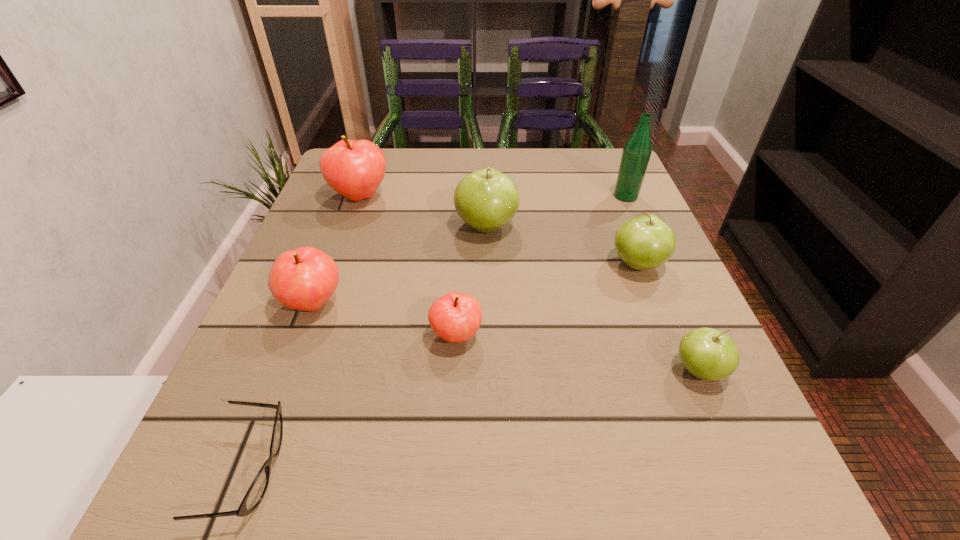
The width and height of the screenshot is (960, 540). In the image, there is a desktop. What are the coordinates of `vacant region at the far left corner` in the screenshot? It's located at (398, 159).

Identify the location of vacant region at the far right corner of the desktop. (566, 158).

Where is `empty space that is in between the bottle and the smallest green apple`? empty space that is in between the bottle and the smallest green apple is located at coordinates (662, 284).

This screenshot has height=540, width=960. Find the location of `free space between the second smallest red apple and the second smallest green apple`. free space between the second smallest red apple and the second smallest green apple is located at coordinates (475, 284).

Locate an element on the screen. This screenshot has width=960, height=540. vacant area that lies between the second biggest red apple and the farthest red apple is located at coordinates (337, 250).

I want to click on unoccupied area between the smallest green apple and the second smallest red apple, so click(x=506, y=337).

Where is `free space between the black spectacles and the leftmost green apple`? free space between the black spectacles and the leftmost green apple is located at coordinates (368, 348).

You are a GUI agent. You are given a task and a screenshot of the screen. Output one action in this format:
    pyautogui.click(x=<x>, y=<y>)
    Task: Click on the vacant space that is in between the second smallest green apple and the second biggest red apple
    
    Given the screenshot: What is the action you would take?
    pyautogui.click(x=475, y=284)

The image size is (960, 540). In order to click on vacant area that lies between the second biggest red apple and the biggest green apple in this screenshot , I will do `click(399, 265)`.

What are the coordinates of `object that can be found as the fourth closest to the biggest red apple` in the screenshot? It's located at (645, 242).